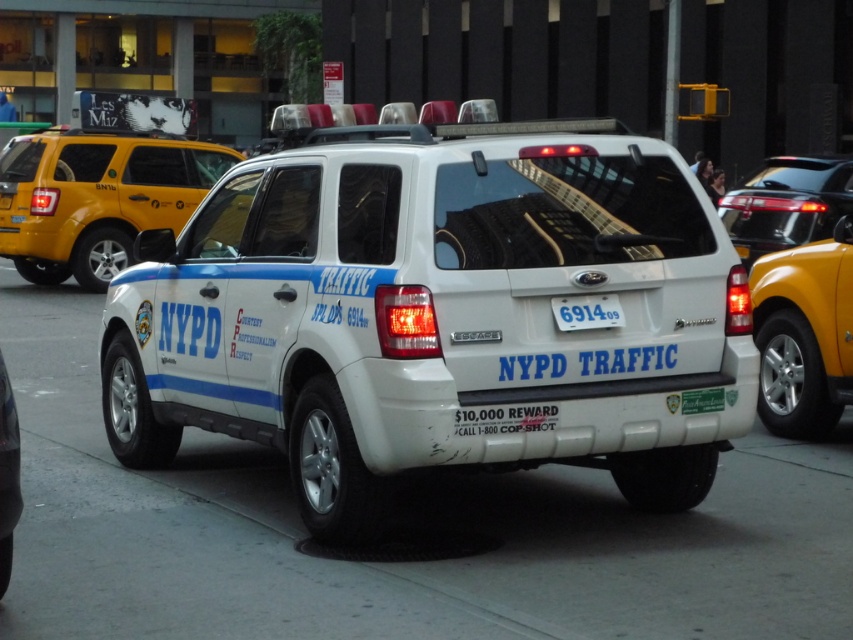
You are a pedestrian standing at the point with coordinates point (815, 244). You want to walk to the point (614, 566). Which direction should you move relative to the white Ford Escape SUV?

You should move towards the front of the white Ford Escape SUV because point (614, 566) is in front of point (815, 244).

You are a pedestrian standing on the sidewalk and see the white plastic license plate at center and the metallic yellow taxi at right in the image. Which object is positioned further to the right?

The metallic yellow taxi at right is positioned further to the right than the white plastic license plate at center.